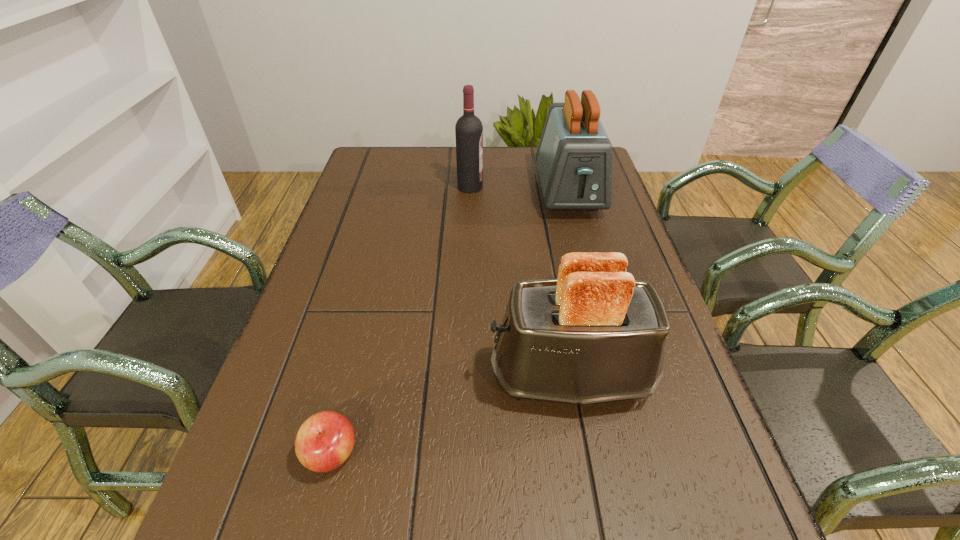
You are a GUI agent. You are given a task and a screenshot of the screen. Output one action in this format:
    pyautogui.click(x=<x>, y=<y>)
    Task: Click on the vacant space in between the farther toaster and the second object from left to right
    The height and width of the screenshot is (540, 960).
    Given the screenshot: What is the action you would take?
    pyautogui.click(x=519, y=190)

Find the location of a particular element. The width and height of the screenshot is (960, 540). free space that is in between the farther toaster and the shortest object is located at coordinates (450, 323).

I want to click on free space between the nearest object and the wine bottle, so click(x=400, y=320).

This screenshot has height=540, width=960. I want to click on empty location between the farther toaster and the shortest object, so click(450, 323).

This screenshot has width=960, height=540. In order to click on free spot between the second object from left to right and the nearest object in this screenshot , I will do `click(400, 320)`.

Where is `free space between the wine bottle and the farther toaster`? free space between the wine bottle and the farther toaster is located at coordinates (519, 190).

The width and height of the screenshot is (960, 540). I want to click on free spot between the farther toaster and the wine bottle, so [519, 190].

Locate an element on the screen. object that is the closest one to the wine bottle is located at coordinates (574, 157).

Select which object is the second closest to the second nearest object. Please provide its 2D coordinates. Your answer should be formatted as a tuple, i.e. [(x, y)], where the tuple contains the x and y coordinates of a point satisfying the conditions above.

[(574, 157)]

Where is `free point that satisfies the following two spatial constraints: 1. on the front-facing side of the farther toaster; 2. on the side of the third farthest object with the control lever`? free point that satisfies the following two spatial constraints: 1. on the front-facing side of the farther toaster; 2. on the side of the third farthest object with the control lever is located at coordinates (618, 376).